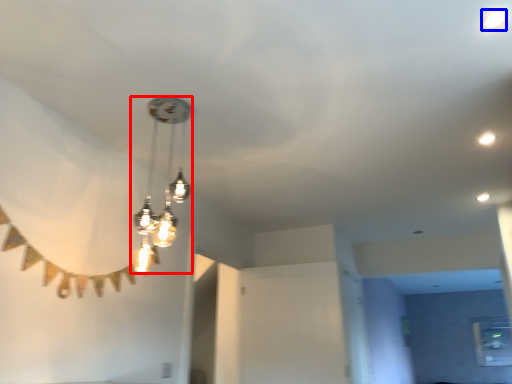
Question: Which object is further to the camera taking this photo, lamp (highlighted by a red box) or droplight (highlighted by a blue box)?

Choices:
 (A) lamp
 (B) droplight

Answer: (A)